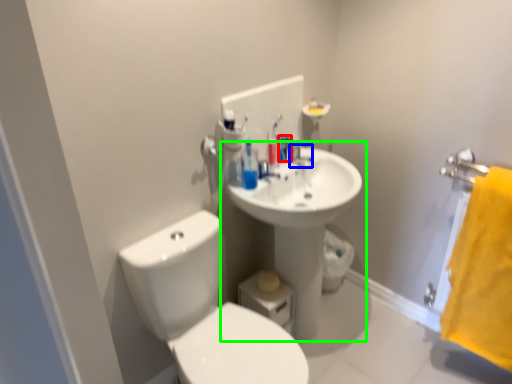
Question: Based on their relative distances, which object is farther from mouthwash (highlighted by a red box)? Choose from plumbing fixture (highlighted by a blue box) and sink (highlighted by a green box).

Choices:
 (A) plumbing fixture
 (B) sink

Answer: (B)